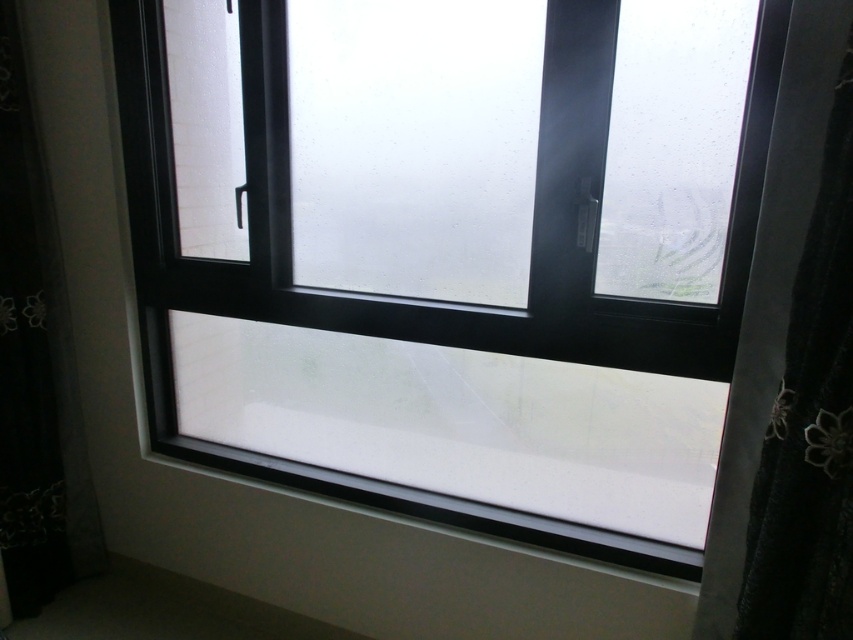
Does transparent glass window at center have a lesser height compared to black textured curtain at right?

No.

Which is in front, point (404, 435) or point (820, 356)?

Point (820, 356) is in front.

What do you see at coordinates (451, 250) in the screenshot?
I see `transparent glass window at center` at bounding box center [451, 250].

This screenshot has width=853, height=640. I want to click on transparent glass window at center, so click(451, 250).

Who is shorter, black lace curtain at left or white smooth window sill at center?

With less height is white smooth window sill at center.

Is black lace curtain at left shorter than white smooth window sill at center?

No, black lace curtain at left is not shorter than white smooth window sill at center.

Measure the distance between point (21, 289) and camera.

A distance of 2.04 meters exists between point (21, 289) and camera.

In order to click on black lace curtain at left in this screenshot , I will do `click(36, 369)`.

Is transparent glass window at center to the left of white smooth window sill at center from the viewer's perspective?

Incorrect, transparent glass window at center is not on the left side of white smooth window sill at center.

Image resolution: width=853 pixels, height=640 pixels. What do you see at coordinates (451, 250) in the screenshot? I see `transparent glass window at center` at bounding box center [451, 250].

Locate an element on the screen. This screenshot has width=853, height=640. transparent glass window at center is located at coordinates (451, 250).